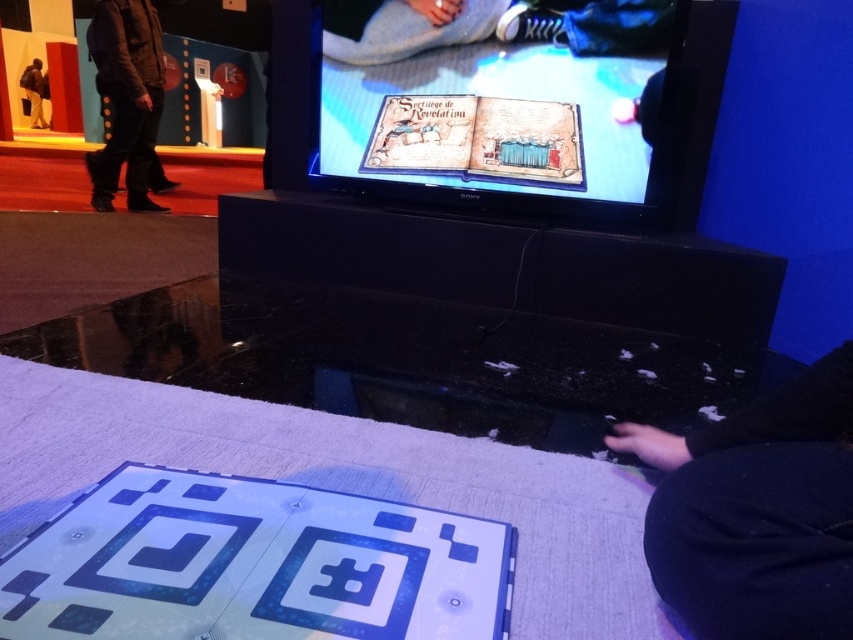
You are standing at the edge of the scene and need to reach both the black fabric pants at lower right and the black suede boots at left. Which item is farther away from your current position?

The black fabric pants at lower right is 4.42 meters away from black suede boots at left. Since you are at the edge of the scene, the distance between the two items suggests that the black fabric pants at lower right is farther away from your current position compared to the black suede boots at left.

You are organizing a clothing store and need to arrange the black fabric pants at lower right and the brown leather jacket at upper left. According to their positions in the image, which clothing item is located to the right of the other?

The black fabric pants at lower right is positioned on the right side of brown leather jacket at upper left.